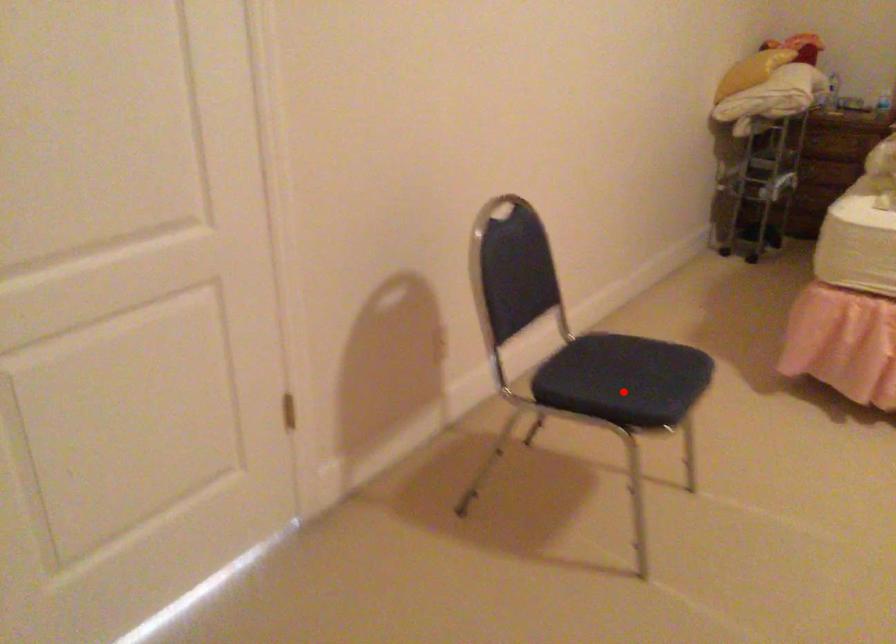
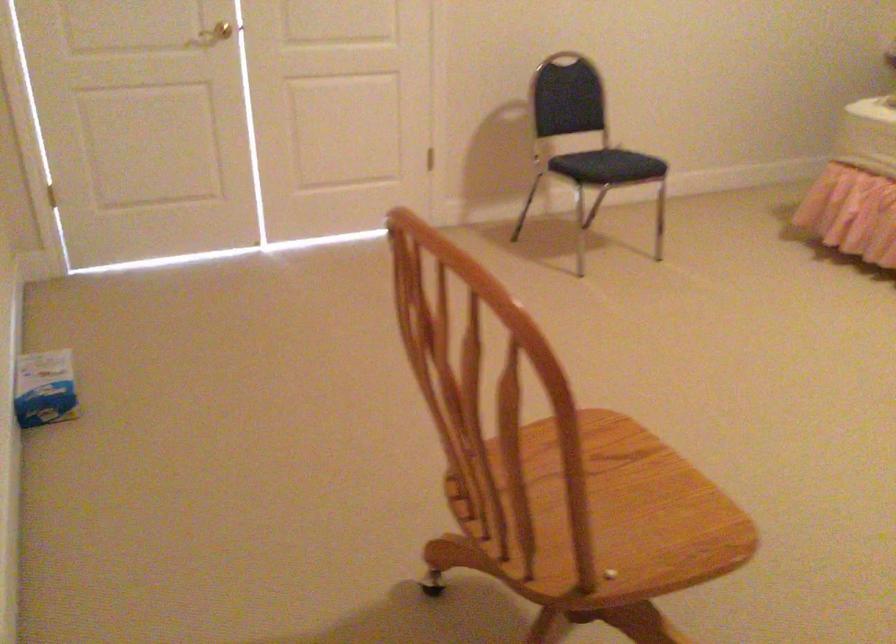
Find the pixel in the second image that matches the highlighted location in the first image.

(607, 166)